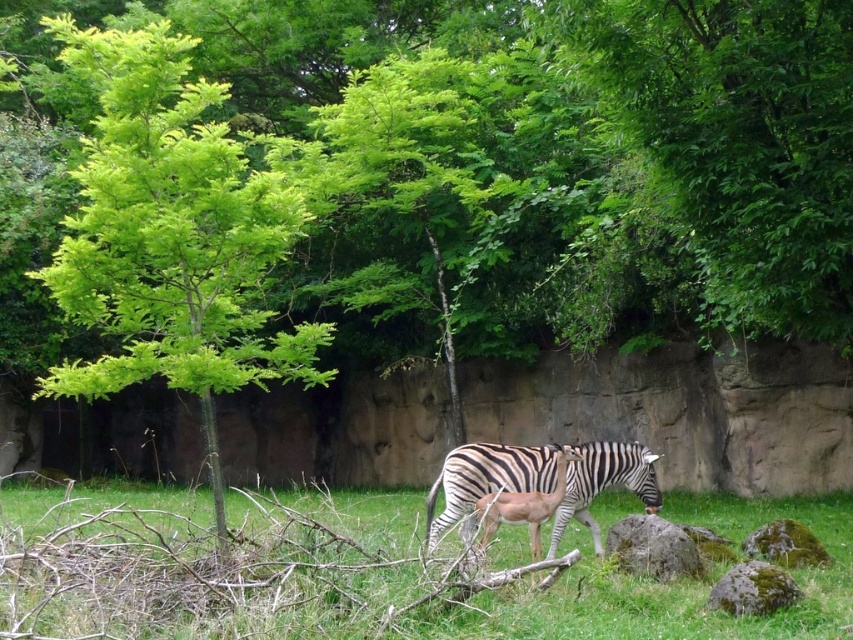
You are a drone operator trying to capture a photo of the two zebras in the scene. To ensure the green grass at center is in the frame, where should you position the camera relative to the zebras?

The green grass at center is located at point (x=364, y=572) in the 2D plane, so positioning the camera to focus on this coordinate will ensure the green grass at center is in the frame while capturing the two zebras.

You are a wildlife photographer aiming to capture the zebras in the scene. You notice a specific point at coordinates point (524,506). Which animal in the scene is this point located on?

The point (524,506) is on the smooth brown antelope at center.

You are a wildlife photographer aiming to capture a closeup shot of the black and white striped zebra at center. You are currently standing 10 feet away from the green mossy rock at lower right. Can you get within 5 feet of the zebra without moving the rock?

The black and white striped zebra at center is 7.86 feet away from the green mossy rock at lower right. Since you are 10 feet away from the rock, moving towards the zebra would require closing the 7.86 feet distance. However, to get within 5 feet of the zebra, you need to be at least 5 feet closer than its current position relative to the rock. Since 10 feet minus 7.86 feet equals 2.14 feet, you are already beyond the required 5 feet proximity. Therefore, you cannot get closer than approximately 2.14 feet,